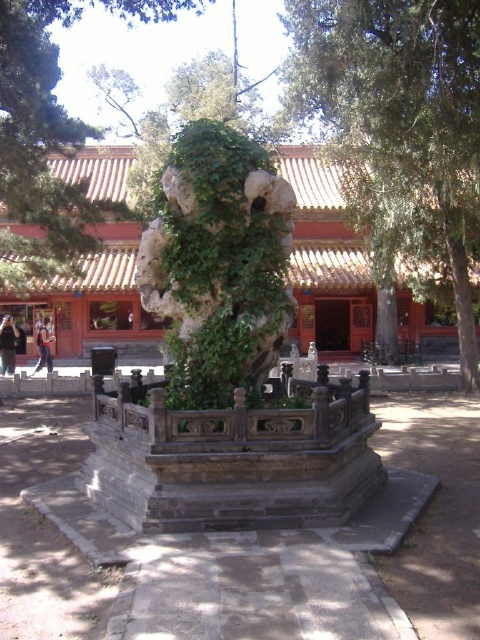
You are standing at the entrance of the site and want to locate the green mossy stone statue at center. According to the coordinates provided, where should you look to find it?

The green mossy stone statue at center is located at point coordinates of (x=217, y=262).

You are a visitor standing at the entrance of the historical site and see the green mossy stone statue at center and the dark blue jeans at lower left. Which object is taller?

The green mossy stone statue at center is much taller than the dark blue jeans at lower left.